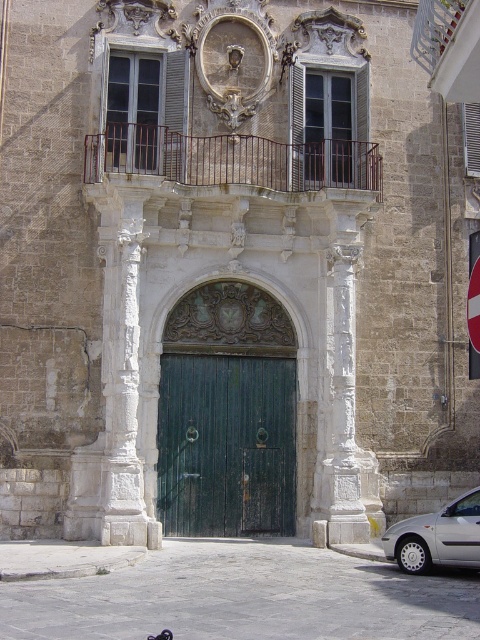
Does white stone column at left have a lesser width compared to silver metallic car at lower right?

Yes, white stone column at left is thinner than silver metallic car at lower right.

At what (x,y) coordinates should I click in order to perform the action: click on white stone column at left. Please return your answer as a coordinate pair (x, y). Image resolution: width=480 pixels, height=640 pixels. Looking at the image, I should click on (123, 381).

Based on the photo, who is higher up, silver metallic car at lower right or white plastic sign at upper right?

Positioned higher is white plastic sign at upper right.

Between silver metallic car at lower right and white plastic sign at upper right, which one appears on the right side from the viewer's perspective?

Positioned to the right is white plastic sign at upper right.

Does point (409, 534) come closer to viewer compared to point (476, 273)?

Yes.

The image size is (480, 640). What are the coordinates of `silver metallic car at lower right` in the screenshot? It's located at (436, 536).

Does green wooden door at center appear on the right side of white plastic sign at upper right?

In fact, green wooden door at center is to the left of white plastic sign at upper right.

This screenshot has width=480, height=640. What do you see at coordinates (226, 444) in the screenshot?
I see `green wooden door at center` at bounding box center [226, 444].

Image resolution: width=480 pixels, height=640 pixels. What are the coordinates of `green wooden door at center` in the screenshot? It's located at (226, 444).